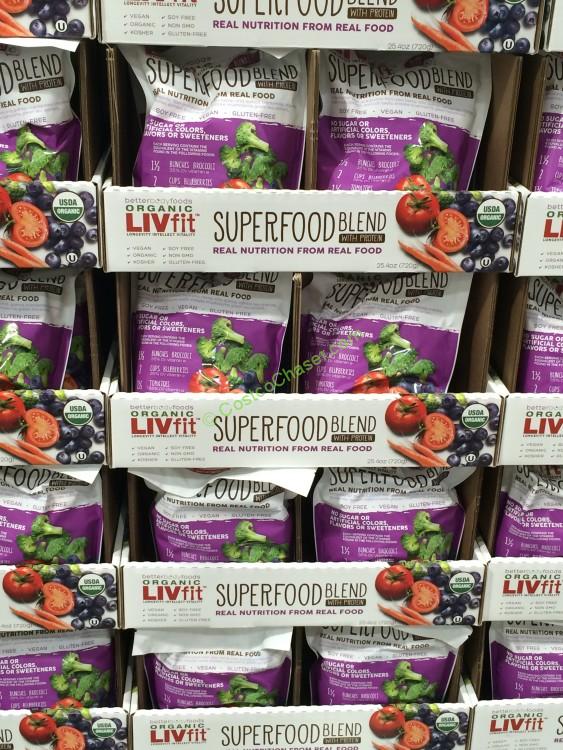
This screenshot has width=563, height=750. I want to click on food display, so click(x=300, y=316).